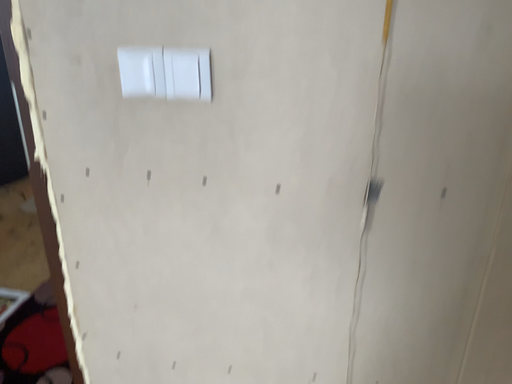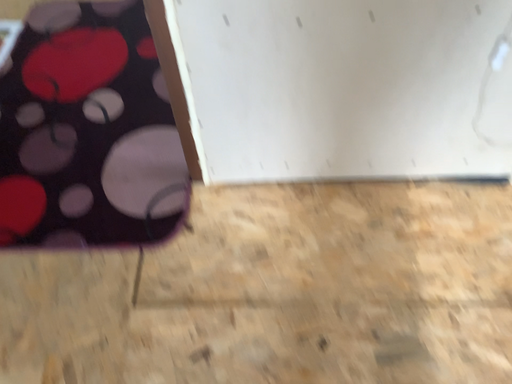
Question: How did the camera likely rotate when shooting the video?

Choices:
 (A) rotated left
 (B) rotated right

Answer: (B)